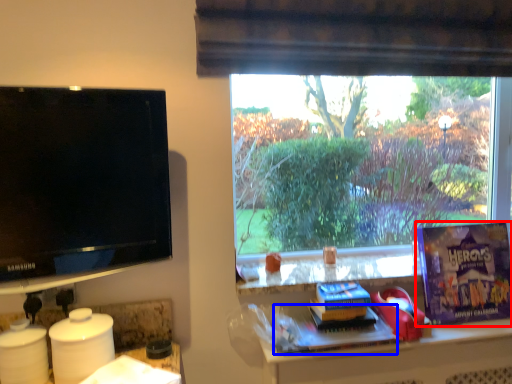
Question: Which point is closer to the camera, paperback book (highlighted by a red box) or book (highlighted by a blue box)?

Choices:
 (A) paperback book
 (B) book

Answer: (B)